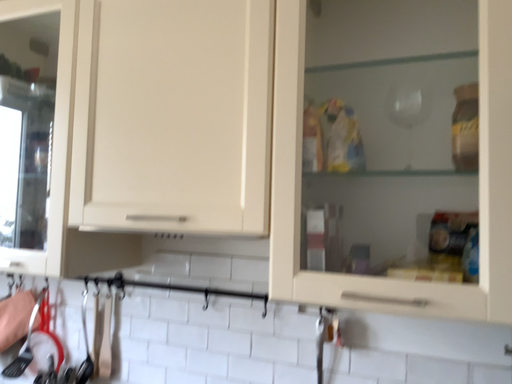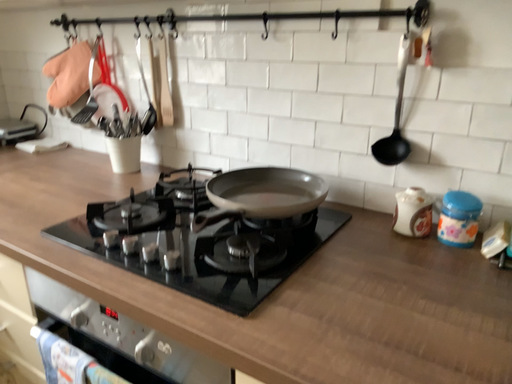
Question: Which way did the camera rotate in the video?

Choices:
 (A) rotated upward
 (B) rotated downward

Answer: (B)